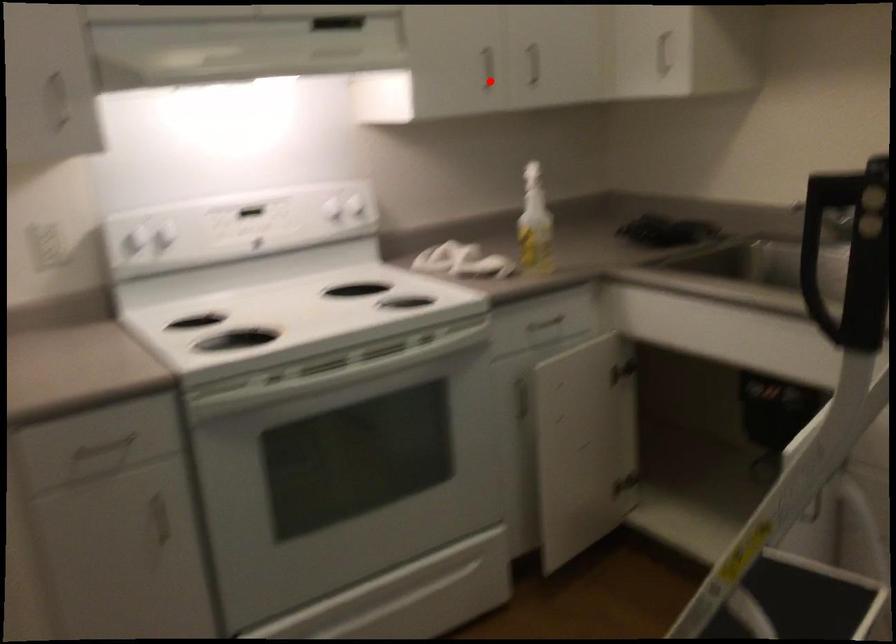
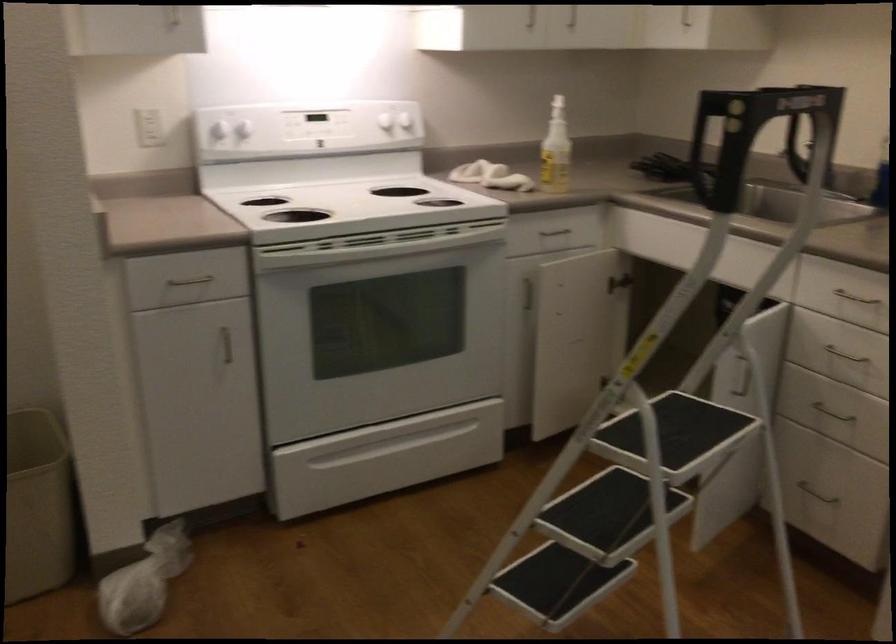
Question: I am providing you with two images of the same scene from different viewpoints. Image1 has a red point marked. In image2, the corresponding 3D location appears at what relative position? Reply with the corresponding letter.

Choices:
 (A) Closer
 (B) Farther

Answer: (B)